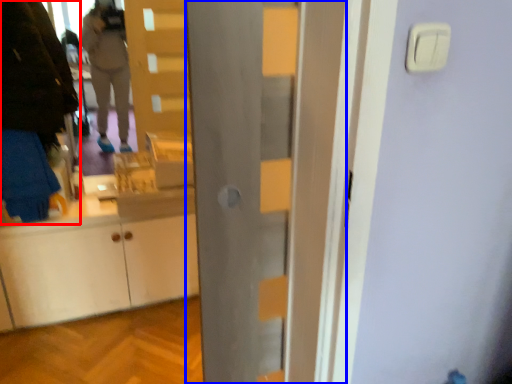
Question: Which of the following is the farthest to the observer, person (highlighted by a red box) or door (highlighted by a blue box)?

Choices:
 (A) person
 (B) door

Answer: (A)